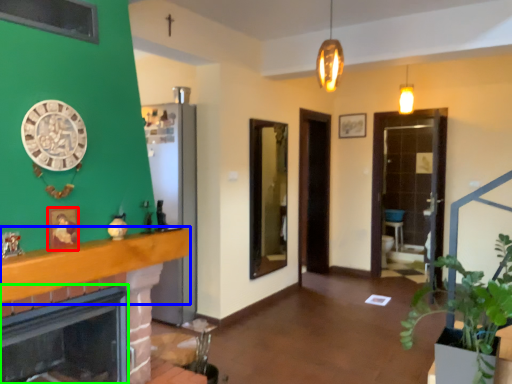
Question: Which object is positioned farthest from picture frame (highlighted by a red box)? Select from balustrade (highlighted by a blue box) and fireplace (highlighted by a green box).

Choices:
 (A) balustrade
 (B) fireplace

Answer: (B)